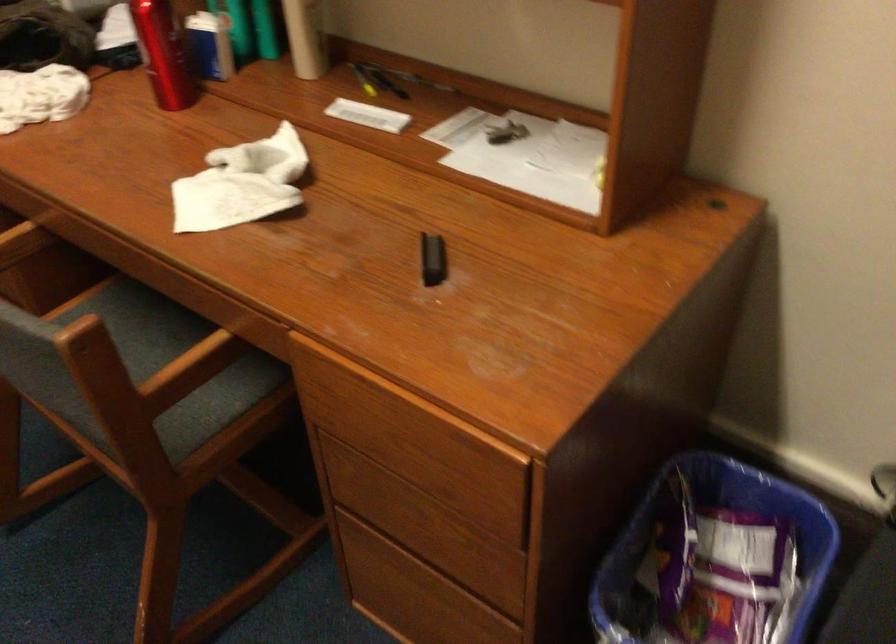
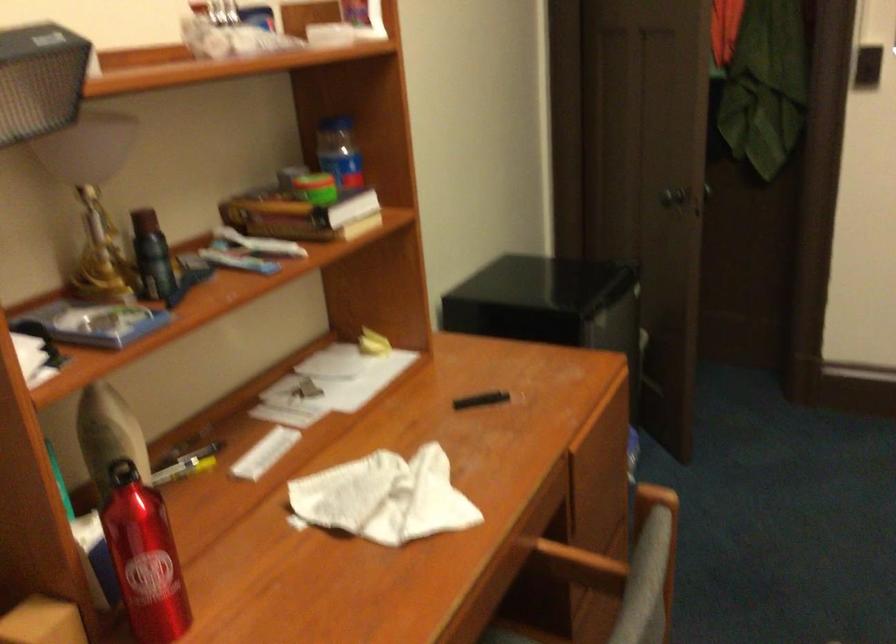
Where in the second image is the point corresponding to the point at 440,259 from the first image?

(480, 400)